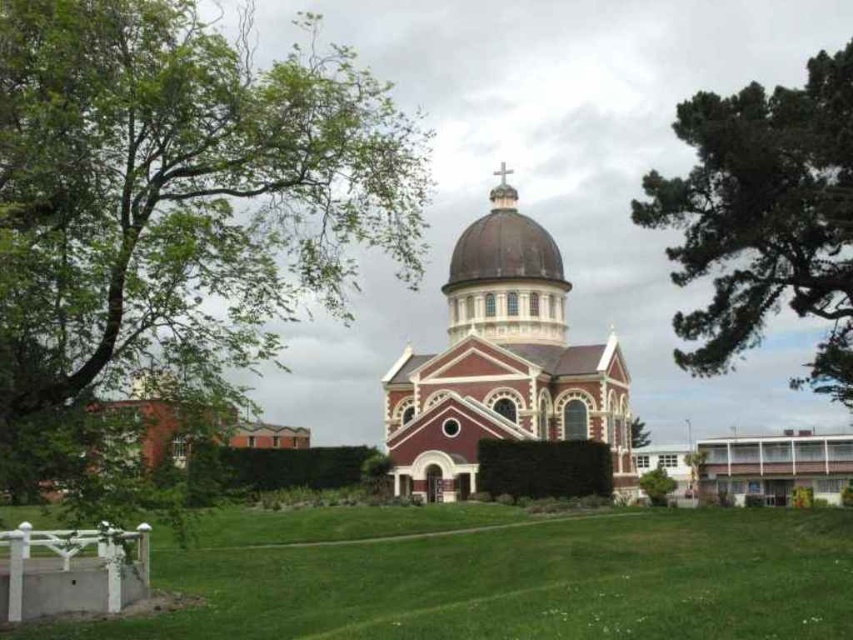
Does smooth gold dome at center lie in front of green leafy tree at center?

No, smooth gold dome at center is behind green leafy tree at center.

The height and width of the screenshot is (640, 853). Identify the location of smooth gold dome at center. (502, 189).

Who is more distant from viewer, (496, 208) or (646, 442)?

The point (496, 208) is behind.

Identify the location of smooth gold dome at center. (502, 189).

Is green leafy tree at upper left bigger than green leafy tree at lower right?

Correct, green leafy tree at upper left is larger in size than green leafy tree at lower right.

Locate an element on the screen. green leafy tree at upper left is located at coordinates (177, 193).

How distant is green needle-like leaves at upper right from smooth gold dome at center?

green needle-like leaves at upper right is 40.26 meters from smooth gold dome at center.

Is point (792, 90) less distant than point (492, 189)?

Yes.

Does point (827, 193) lie in front of point (511, 198)?

Yes, it is in front of point (511, 198).

This screenshot has width=853, height=640. Identify the location of green needle-like leaves at upper right. (764, 218).